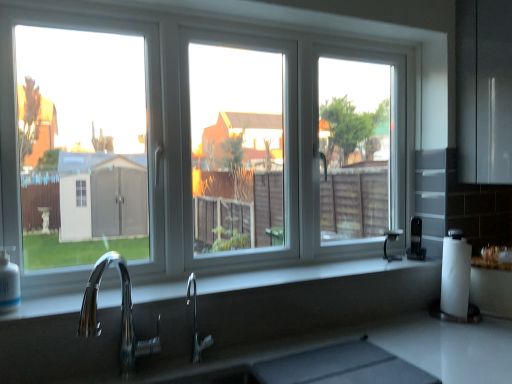
Locate an element on the screen. This screenshot has height=384, width=512. vacant space positioned to the left of black plastic coffee maker at right is located at coordinates (376, 255).